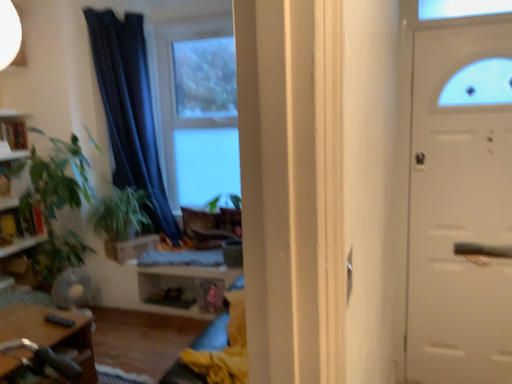
Question: Does green leafy plant at left come in front of dark blue fabric curtain at center?

Choices:
 (A) yes
 (B) no

Answer: (A)

Question: Can you confirm if green leafy plant at left is taller than dark blue fabric curtain at center?

Choices:
 (A) yes
 (B) no

Answer: (B)

Question: Is green leafy plant at left beside dark blue fabric curtain at center?

Choices:
 (A) yes
 (B) no

Answer: (B)

Question: From the image's perspective, does green leafy plant at left appear lower than dark blue fabric curtain at center?

Choices:
 (A) yes
 (B) no

Answer: (A)

Question: Considering the relative positions of green leafy plant at left and dark blue fabric curtain at center in the image provided, is green leafy plant at left to the left of dark blue fabric curtain at center from the viewer's perspective?

Choices:
 (A) yes
 (B) no

Answer: (A)

Question: Looking at the image, does green leafy plant at left seem bigger or smaller compared to wooden bookshelf at left?

Choices:
 (A) small
 (B) big

Answer: (B)

Question: From the image's perspective, is green leafy plant at left above or below wooden bookshelf at left?

Choices:
 (A) above
 (B) below

Answer: (B)

Question: Is green leafy plant at left in front of or behind wooden bookshelf at left in the image?

Choices:
 (A) front
 (B) behind

Answer: (A)

Question: Is point (74, 157) positioned closer to the camera than point (19, 127)?

Choices:
 (A) closer
 (B) farther

Answer: (A)

Question: Does point (216, 34) appear closer or farther from the camera than point (143, 248)?

Choices:
 (A) closer
 (B) farther

Answer: (B)

Question: From the image's perspective, relative to brown cardboard drawer at center, is clear glass window at center above or below?

Choices:
 (A) above
 (B) below

Answer: (A)

Question: In terms of width, does clear glass window at center look wider or thinner when compared to brown cardboard drawer at center?

Choices:
 (A) thin
 (B) wide

Answer: (A)

Question: Which is correct: clear glass window at center is inside brown cardboard drawer at center, or outside of it?

Choices:
 (A) outside
 (B) inside

Answer: (A)

Question: Does point (4, 155) appear closer or farther from the camera than point (14, 350)?

Choices:
 (A) closer
 (B) farther

Answer: (B)

Question: Looking at their shapes, would you say wooden bookshelf at left is wider or thinner than wooden table at lower left?

Choices:
 (A) wide
 (B) thin

Answer: (B)